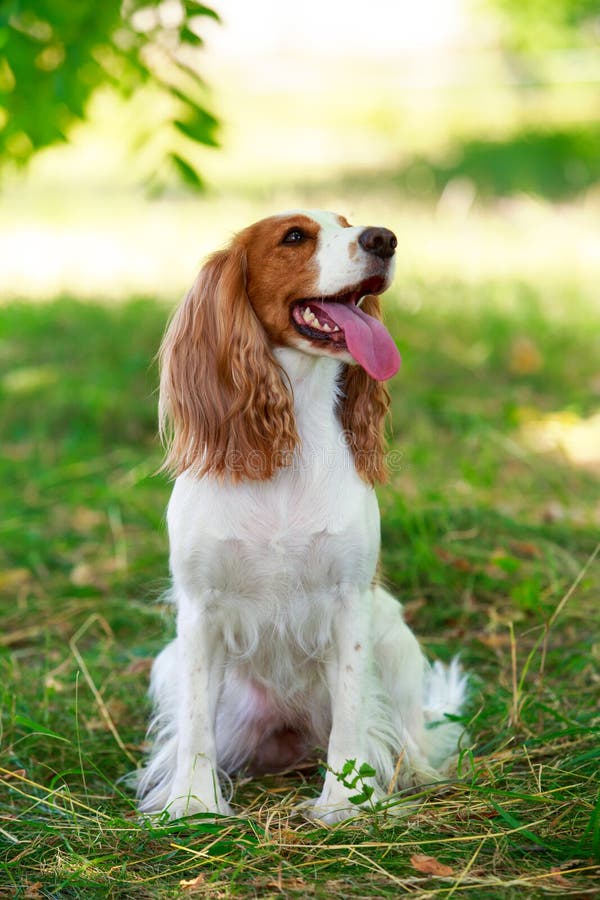
This screenshot has width=600, height=900. Find the location of `white fur`. white fur is located at coordinates (305, 558).